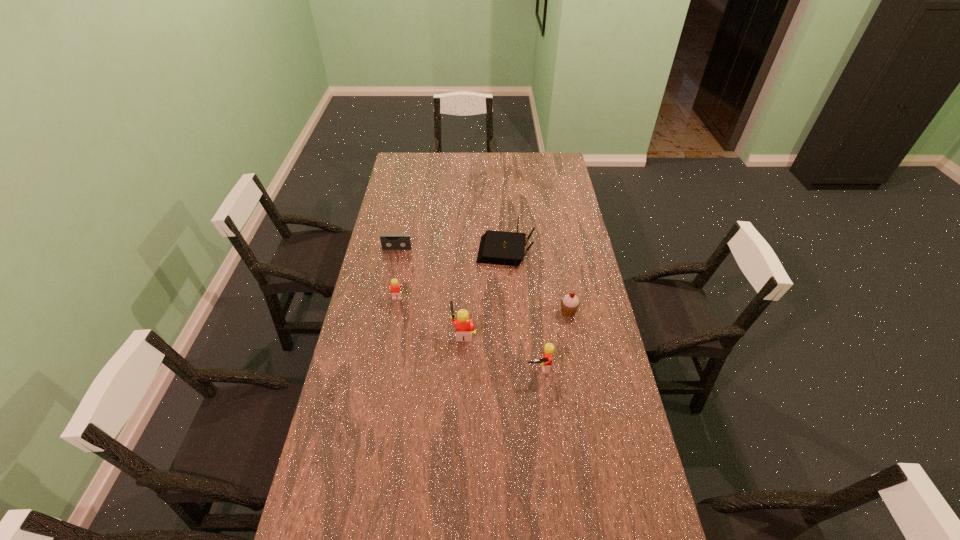
Locate an element on the screen. Image resolution: width=960 pixels, height=540 pixels. vacant point at the near edge is located at coordinates (479, 509).

In the image, there is a desktop. Find the location of `vacant space at the left edge`. vacant space at the left edge is located at coordinates (331, 462).

At what (x,y) coordinates should I click in order to perform the action: click on free region at the right edge of the desktop. Please return your answer as a coordinate pair (x, y). The height and width of the screenshot is (540, 960). Looking at the image, I should click on (635, 494).

This screenshot has width=960, height=540. Find the location of `vacant space at the far right corner of the desktop`. vacant space at the far right corner of the desktop is located at coordinates (538, 164).

The height and width of the screenshot is (540, 960). I want to click on empty space between the router and the nearest object, so click(x=522, y=310).

The image size is (960, 540). I want to click on blank region between the router and the videotape, so click(451, 251).

Find the location of a particular element. free space that is in between the videotape and the tallest Lego is located at coordinates (430, 291).

Identify the location of free point between the videotape and the fifth farthest object. (430, 291).

Locate an element on the screen. The image size is (960, 540). free space between the tallest object and the leftmost Lego is located at coordinates (430, 317).

Identify the location of vacant area between the router and the cupcake. (537, 282).